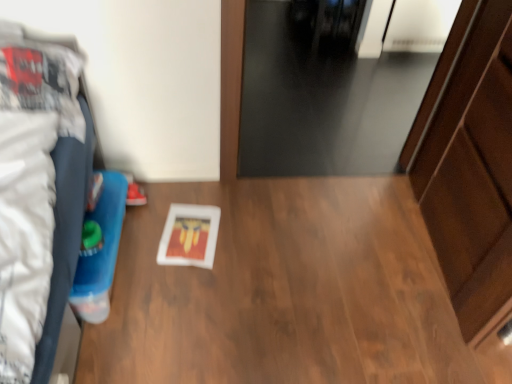
Locate an element on the screen. The image size is (512, 384). free spot in front of wooden dresser at right is located at coordinates (417, 321).